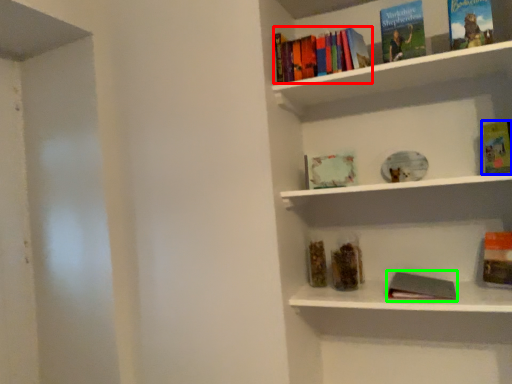
Question: Based on their relative distances, which object is farther from book (highlighted by a red box)? Choose from book (highlighted by a blue box) and book (highlighted by a green box).

Choices:
 (A) book
 (B) book

Answer: (B)